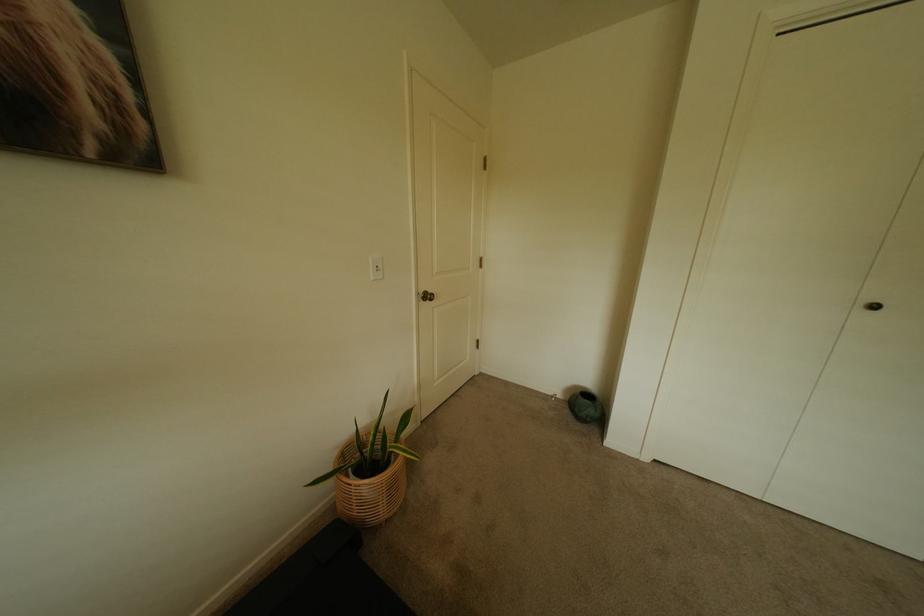
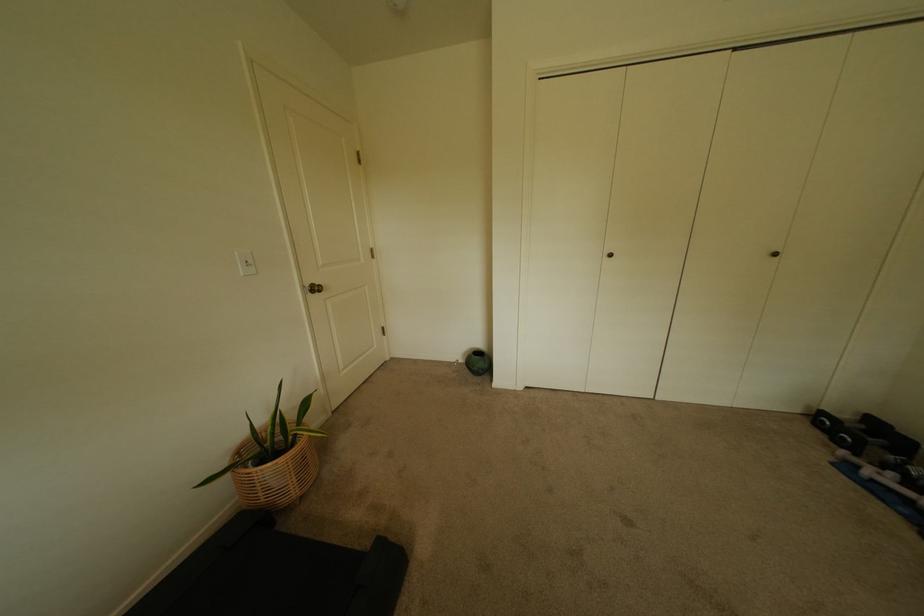
Locate, in the second image, the point that corresponds to (x=379, y=259) in the first image.

(245, 254)